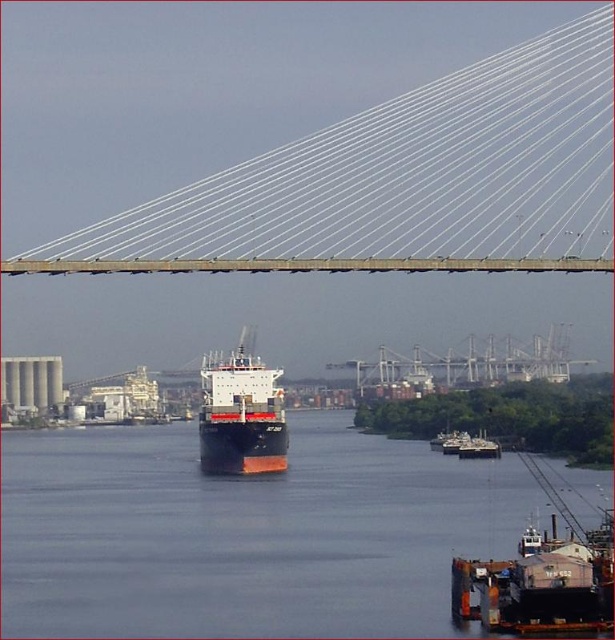
Question: Can you confirm if dark blue water at center is positioned below metallic gray boat at center?

Choices:
 (A) no
 (B) yes

Answer: (B)

Question: Does dark blue water at center appear on the left side of black matte container ship at center?

Choices:
 (A) no
 (B) yes

Answer: (B)

Question: Can you confirm if dark blue water at center is wider than white cable-stayed bridge at upper center?

Choices:
 (A) no
 (B) yes

Answer: (A)

Question: Which of the following is the closest to the observer?

Choices:
 (A) white cable-stayed bridge at upper center
 (B) metallic gray suspension bridge at center

Answer: (A)

Question: Which object appears farthest from the camera in this image?

Choices:
 (A) metallic gray suspension bridge at center
 (B) white cable-stayed bridge at upper center
 (C) metallic gray boat at center
 (D) black matte container ship at center

Answer: (A)

Question: Estimate the real-world distances between objects in this image. Which object is farther from the white cable-stayed bridge at upper center?

Choices:
 (A) metallic gray suspension bridge at center
 (B) dark blue water at center

Answer: (B)